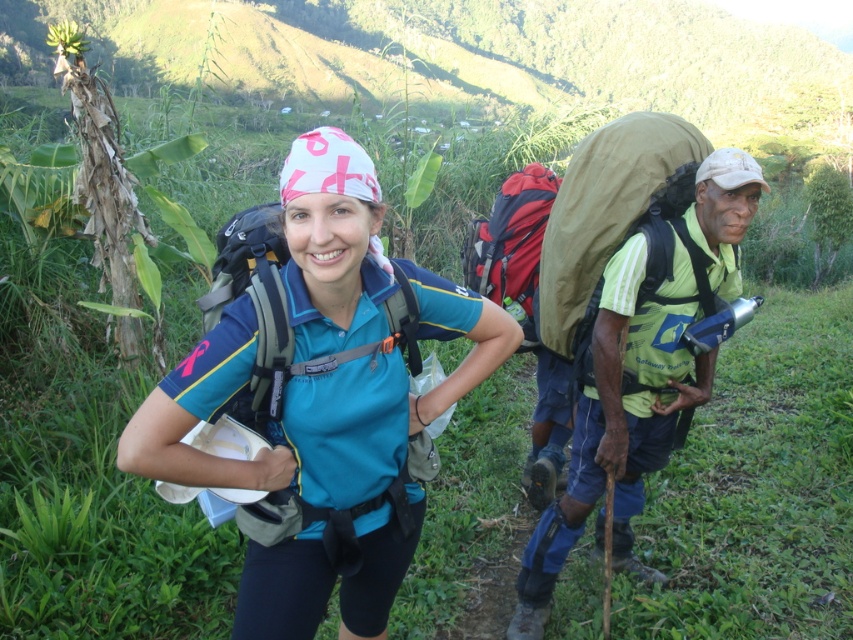
What is the point at coordinate (643, 371) located on?

The point at coordinate (643, 371) is located on the green fabric backpack at right.

You are standing at the starting point of the hiking trail and see the woman in the blue polo shirt and the green fabric backpack at right. Which object is closer to you?

The woman in the blue polo shirt is closer to you because the green fabric backpack at right is 8.47 feet away from the viewer, so the backpack is further away than the woman.

You are planning to carry both the green fabric backpack at right and the matte gray backpack at center during your hike. Which backpack has a greater width?

The green fabric backpack at right has a greater width than the matte gray backpack at center.